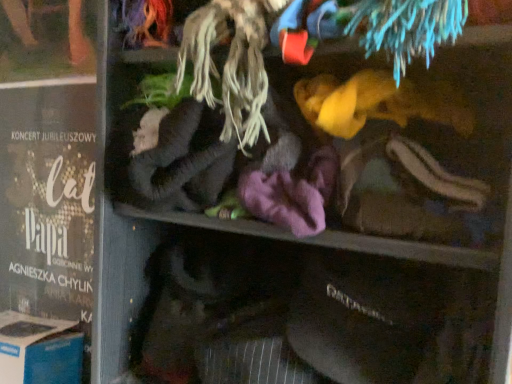
The image size is (512, 384). Identify the location of blue cardboard box at lower left. (39, 350).

What do you see at coordinates (39, 350) in the screenshot? This screenshot has width=512, height=384. I see `blue cardboard box at lower left` at bounding box center [39, 350].

Describe the element at coordinates (48, 159) in the screenshot. The width and height of the screenshot is (512, 384). I see `matte black poster at left` at that location.

Locate an element on the screen. This screenshot has width=512, height=384. matte black poster at left is located at coordinates (48, 159).

You are a GUI agent. You are given a task and a screenshot of the screen. Output one action in this format:
    pyautogui.click(x=<x>, y=<y>)
    Task: Click on the blue cardboard box at lower left
    The width and height of the screenshot is (512, 384).
    Given the screenshot: What is the action you would take?
    pyautogui.click(x=39, y=350)

Between matte black poster at left and blue cardboard box at lower left, which one appears on the right side from the viewer's perspective?

matte black poster at left.

Between matte black poster at left and blue cardboard box at lower left, which one is positioned behind?

matte black poster at left is more distant.

Is point (52, 57) positioned behind point (18, 373)?

Yes, it is.

From the image's perspective, is matte black poster at left located beneath blue cardboard box at lower left?

Actually, matte black poster at left appears above blue cardboard box at lower left in the image.

In the scene shown: From a real-world perspective, is matte black poster at left on blue cardboard box at lower left?

Yes, from a real-world perspective, matte black poster at left is over blue cardboard box at lower left

Consider the image. Is matte black poster at left wider or thinner than blue cardboard box at lower left?

matte black poster at left is thinner than blue cardboard box at lower left.

Looking at this image, is matte black poster at left taller than blue cardboard box at lower left?

Correct, matte black poster at left is much taller as blue cardboard box at lower left.

In terms of size, does matte black poster at left appear bigger or smaller than blue cardboard box at lower left?

Considering their sizes, matte black poster at left takes up less space than blue cardboard box at lower left.

Does matte black poster at left contain blue cardboard box at lower left?

Actually, blue cardboard box at lower left is outside matte black poster at left.

From the picture: Are matte black poster at left and blue cardboard box at lower left located far from each other?

No.

Could you tell me if matte black poster at left is facing blue cardboard box at lower left?

Yes, matte black poster at left faces towards blue cardboard box at lower left.

Image resolution: width=512 pixels, height=384 pixels. What are the coordinates of `cardboard box beneath the matte black poster at left (from a real-world perspective)` in the screenshot? It's located at (39, 350).

Considering the relative positions of blue cardboard box at lower left and matte black poster at left in the image provided, is blue cardboard box at lower left to the right of matte black poster at left from the viewer's perspective?

No.

Is blue cardboard box at lower left behind matte black poster at left?

No, it is in front of matte black poster at left.

Which is in front, point (56, 352) or point (26, 96)?

The point (56, 352) is in front.

From the image's perspective, is blue cardboard box at lower left over matte black poster at left?

No, from the image's perspective, blue cardboard box at lower left is not above matte black poster at left.

From a real-world perspective, is blue cardboard box at lower left positioned over matte black poster at left based on gravity?

No, from a real-world perspective, blue cardboard box at lower left is not over matte black poster at left

In terms of width, does blue cardboard box at lower left look wider or thinner when compared to matte black poster at left?

blue cardboard box at lower left is wider than matte black poster at left.

Is blue cardboard box at lower left shorter than matte black poster at left?

Yes.

Consider the image. Considering the sizes of objects blue cardboard box at lower left and matte black poster at left in the image provided, who is smaller, blue cardboard box at lower left or matte black poster at left?

→ matte black poster at left is smaller.

Is blue cardboard box at lower left outside of matte black poster at left?

Indeed, blue cardboard box at lower left is completely outside matte black poster at left.

Are blue cardboard box at lower left and matte black poster at left beside each other?

There is a gap between blue cardboard box at lower left and matte black poster at left.

Based on the photo, is blue cardboard box at lower left turned away from matte black poster at left?

Yes, blue cardboard box at lower left's orientation is away from matte black poster at left.

Looking at this image, how many degrees apart are the facing directions of blue cardboard box at lower left and matte black poster at left?

The angular difference between blue cardboard box at lower left and matte black poster at left is 0.00052 degrees.

What are the coordinates of `book above the blue cardboard box at lower left (from a real-world perspective)` in the screenshot? It's located at (48, 159).

The image size is (512, 384). Find the location of `cardboard box that is on the left side of matte black poster at left`. cardboard box that is on the left side of matte black poster at left is located at coordinates (39, 350).

There is a blue cardboard box at lower left. Where is `book above it (from a real-world perspective)`? This screenshot has width=512, height=384. book above it (from a real-world perspective) is located at coordinates (48, 159).